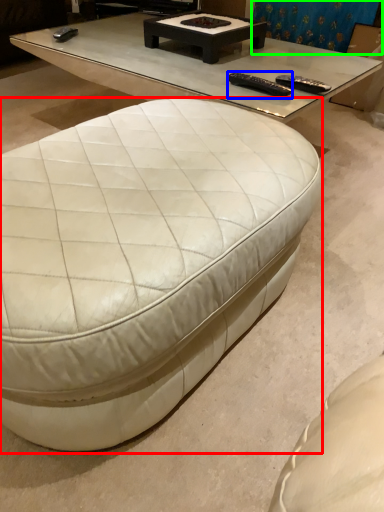
Question: Considering the real-world distances, which object is farthest from coffee table (highlighted by a red box)? remote (highlighted by a blue box) or curtain (highlighted by a green box)?

Choices:
 (A) remote
 (B) curtain

Answer: (B)